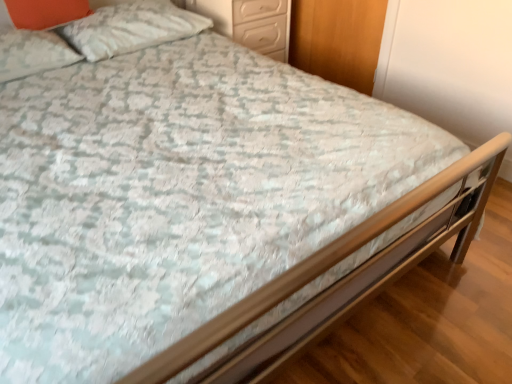
Image resolution: width=512 pixels, height=384 pixels. Describe the element at coordinates (250, 23) in the screenshot. I see `white glossy drawers at upper center` at that location.

Find the location of a particular element. orange matte pillow at upper left, which is the 2th pillow in left-to-right order is located at coordinates (42, 12).

Image resolution: width=512 pixels, height=384 pixels. Describe the element at coordinates (131, 28) in the screenshot. I see `white textured pillow at upper left, the 3th pillow viewed from the left` at that location.

At what (x,y) coordinates should I click in order to perform the action: click on white soft pillow at upper left, which is the first pillow in left-to-right order. Please return your answer as a coordinate pair (x, y). Looking at the image, I should click on (33, 53).

From a real-world perspective, which object rests below the other?

white soft pillow at upper left, the third pillow from the right, from a real-world perspective.

Can you confirm if white soft pillow at upper left, the third pillow from the right, is positioned to the left of orange matte pillow at upper left, which is the 2th pillow in left-to-right order?

Yes.

How many degrees apart are the facing directions of white soft pillow at upper left, the third pillow from the right, and orange matte pillow at upper left, which is the 2th pillow in left-to-right order?

white soft pillow at upper left, the third pillow from the right, and orange matte pillow at upper left, which is the 2th pillow in left-to-right order, are facing 1.81 degrees away from each other.

From the image's perspective, which is above, white soft pillow at upper left, which is the first pillow in left-to-right order, or orange matte pillow at upper left, which appears as the second pillow when viewed from the right?

orange matte pillow at upper left, which appears as the second pillow when viewed from the right, is shown above in the image.

From a real-world perspective, between white textured pillow at upper left, the first pillow in the right-to-left sequence, and white soft pillow at upper left, which is the first pillow in left-to-right order, who is vertically lower?

white soft pillow at upper left, which is the first pillow in left-to-right order.

Can you tell me how much white textured pillow at upper left, the 3th pillow viewed from the left, and white soft pillow at upper left, the third pillow from the right, differ in facing direction?

0.844 degrees.

Could you tell me if white textured pillow at upper left, the first pillow in the right-to-left sequence, is facing white soft pillow at upper left, which is the first pillow in left-to-right order?

No, white textured pillow at upper left, the first pillow in the right-to-left sequence, is not facing towards white soft pillow at upper left, which is the first pillow in left-to-right order.

Considering the relative sizes of white soft pillow at upper left, which is the first pillow in left-to-right order, and white textured pillow at upper left, the first pillow in the right-to-left sequence, in the image provided, is white soft pillow at upper left, which is the first pillow in left-to-right order, bigger than white textured pillow at upper left, the first pillow in the right-to-left sequence,?

Incorrect, white soft pillow at upper left, which is the first pillow in left-to-right order, is not larger than white textured pillow at upper left, the first pillow in the right-to-left sequence.

Could you tell me if white soft pillow at upper left, the third pillow from the right, is facing white textured pillow at upper left, the 3th pillow viewed from the left?

No, white soft pillow at upper left, the third pillow from the right, is not turned towards white textured pillow at upper left, the 3th pillow viewed from the left.

From the image's perspective, which object appears higher, white soft pillow at upper left, which is the first pillow in left-to-right order, or white textured pillow at upper left, the 3th pillow viewed from the left?

From the image's view, white textured pillow at upper left, the 3th pillow viewed from the left, is above.

From a real-world perspective, is white soft pillow at upper left, which is the first pillow in left-to-right order, positioned over white textured pillow at upper left, the first pillow in the right-to-left sequence, based on gravity?

No.

Considering the relative positions of white glossy drawers at upper center and orange matte pillow at upper left, which is the 2th pillow in left-to-right order, in the image provided, is white glossy drawers at upper center behind orange matte pillow at upper left, which is the 2th pillow in left-to-right order,?

Yes, white glossy drawers at upper center is further from the viewer.

Is white glossy drawers at upper center wider or thinner than orange matte pillow at upper left, which appears as the second pillow when viewed from the right?

In the image, white glossy drawers at upper center appears to be wider than orange matte pillow at upper left, which appears as the second pillow when viewed from the right.

Does white glossy drawers at upper center have a greater height compared to orange matte pillow at upper left, which is the 2th pillow in left-to-right order?

Yes, white glossy drawers at upper center is taller than orange matte pillow at upper left, which is the 2th pillow in left-to-right order.

Is white glossy drawers at upper center to the left of orange matte pillow at upper left, which is the 2th pillow in left-to-right order, from the viewer's perspective?

Incorrect, white glossy drawers at upper center is not on the left side of orange matte pillow at upper left, which is the 2th pillow in left-to-right order.

Would you say white textured pillow at upper left, the 3th pillow viewed from the left, contains orange matte pillow at upper left, which appears as the second pillow when viewed from the right?

No, white textured pillow at upper left, the 3th pillow viewed from the left, does not contain orange matte pillow at upper left, which appears as the second pillow when viewed from the right.

Considering the sizes of objects white textured pillow at upper left, the first pillow in the right-to-left sequence, and orange matte pillow at upper left, which is the 2th pillow in left-to-right order, in the image provided, who is taller, white textured pillow at upper left, the first pillow in the right-to-left sequence, or orange matte pillow at upper left, which is the 2th pillow in left-to-right order,?

orange matte pillow at upper left, which is the 2th pillow in left-to-right order, is taller.

Considering the points (127, 44) and (33, 16), which point is in front, point (127, 44) or point (33, 16)?

The point (33, 16) is closer to the camera.

From a real-world perspective, between white textured pillow at upper left, the 3th pillow viewed from the left, and orange matte pillow at upper left, which appears as the second pillow when viewed from the right, who is vertically higher?

orange matte pillow at upper left, which appears as the second pillow when viewed from the right.

Is orange matte pillow at upper left, which is the 2th pillow in left-to-right order, turned away from white glossy drawers at upper center?

No, orange matte pillow at upper left, which is the 2th pillow in left-to-right order, is not facing away from white glossy drawers at upper center.

Is point (49, 10) behind point (258, 17)?

That is False.

How different are the orientations of orange matte pillow at upper left, which appears as the second pillow when viewed from the right, and white glossy drawers at upper center in degrees?

The angle between the facing direction of orange matte pillow at upper left, which appears as the second pillow when viewed from the right, and the facing direction of white glossy drawers at upper center is 0.63 degrees.

Does orange matte pillow at upper left, which is the 2th pillow in left-to-right order, have a smaller size compared to white glossy drawers at upper center?

Yes, orange matte pillow at upper left, which is the 2th pillow in left-to-right order, is smaller than white glossy drawers at upper center.

In terms of width, does white textured pillow at upper left, the 3th pillow viewed from the left, look wider or thinner when compared to white glossy drawers at upper center?

white textured pillow at upper left, the 3th pillow viewed from the left, is thinner than white glossy drawers at upper center.

Is white textured pillow at upper left, the 3th pillow viewed from the left, positioned with its back to white glossy drawers at upper center?

No.

Is white glossy drawers at upper center located within white textured pillow at upper left, the 3th pillow viewed from the left?

No, white glossy drawers at upper center is located outside of white textured pillow at upper left, the 3th pillow viewed from the left.

At what (x,y) coordinates should I click in order to perform the action: click on pillow lying below the orange matte pillow at upper left, which is the 2th pillow in left-to-right order (from the image's perspective). Please return your answer as a coordinate pair (x, y). This screenshot has height=384, width=512. Looking at the image, I should click on (33, 53).

From the image's perspective, which pillow is the 2nd one above the white soft pillow at upper left, the third pillow from the right? Please provide its 2D coordinates.

[(131, 28)]

When comparing their distances from white textured pillow at upper left, the first pillow in the right-to-left sequence, does orange matte pillow at upper left, which appears as the second pillow when viewed from the right, or white soft pillow at upper left, which is the first pillow in left-to-right order, seem closer?

Among the two, orange matte pillow at upper left, which appears as the second pillow when viewed from the right, is located nearer to white textured pillow at upper left, the first pillow in the right-to-left sequence.

Considering their positions, is orange matte pillow at upper left, which is the 2th pillow in left-to-right order, positioned further to white glossy drawers at upper center than white soft pillow at upper left, which is the first pillow in left-to-right order?

white soft pillow at upper left, which is the first pillow in left-to-right order.

Based on their spatial positions, is white soft pillow at upper left, which is the first pillow in left-to-right order, or white textured pillow at upper left, the 3th pillow viewed from the left, further from white glossy drawers at upper center?

white soft pillow at upper left, which is the first pillow in left-to-right order, lies further to white glossy drawers at upper center than the other object.

Estimate the real-world distances between objects in this image. Which object is further from white textured pillow at upper left, the first pillow in the right-to-left sequence, white glossy drawers at upper center or orange matte pillow at upper left, which appears as the second pillow when viewed from the right?

Among the two, white glossy drawers at upper center is located further to white textured pillow at upper left, the first pillow in the right-to-left sequence.

Estimate the real-world distances between objects in this image. Which object is further from white soft pillow at upper left, the third pillow from the right, white glossy drawers at upper center or orange matte pillow at upper left, which is the 2th pillow in left-to-right order?

white glossy drawers at upper center is positioned further to the anchor white soft pillow at upper left, the third pillow from the right.

In the scene shown: From the image, which object appears to be nearer to white glossy drawers at upper center, white textured pillow at upper left, the 3th pillow viewed from the left, or orange matte pillow at upper left, which appears as the second pillow when viewed from the right?

The object closer to white glossy drawers at upper center is white textured pillow at upper left, the 3th pillow viewed from the left.

Estimate the real-world distances between objects in this image. Which object is further from white soft pillow at upper left, the third pillow from the right, white textured pillow at upper left, the first pillow in the right-to-left sequence, or orange matte pillow at upper left, which is the 2th pillow in left-to-right order?

white textured pillow at upper left, the first pillow in the right-to-left sequence.

When comparing their distances from white textured pillow at upper left, the 3th pillow viewed from the left, does orange matte pillow at upper left, which appears as the second pillow when viewed from the right, or white glossy drawers at upper center seem further?

Among the two, white glossy drawers at upper center is located further to white textured pillow at upper left, the 3th pillow viewed from the left.

At what (x,y) coordinates should I click in order to perform the action: click on pillow situated between white soft pillow at upper left, the third pillow from the right, and white textured pillow at upper left, the 3th pillow viewed from the left, from left to right. Please return your answer as a coordinate pair (x, y). Image resolution: width=512 pixels, height=384 pixels. Looking at the image, I should click on (42, 12).

This screenshot has width=512, height=384. In order to click on pillow located between orange matte pillow at upper left, which appears as the second pillow when viewed from the right, and white glossy drawers at upper center in the left-right direction in this screenshot , I will do `click(131, 28)`.